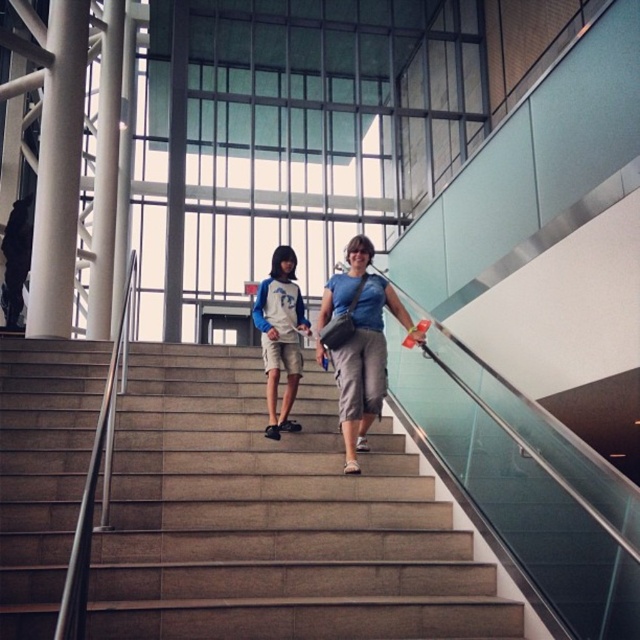
Can you confirm if blue denim shorts at center is positioned above blue and white jersey at center?

No, blue denim shorts at center is not above blue and white jersey at center.

Does blue denim shorts at center have a greater height compared to blue and white jersey at center?

Indeed, blue denim shorts at center has a greater height compared to blue and white jersey at center.

Identify the location of blue denim shorts at center. (358, 344).

Which is in front, point (77, 131) or point (300, 301)?

Point (300, 301)

What do you see at coordinates (58, 172) in the screenshot? I see `white glossy pillar at left` at bounding box center [58, 172].

Locate an element on the screen. This screenshot has width=640, height=640. white glossy pillar at left is located at coordinates (58, 172).

Between concrete stairs at center and blue denim shorts at center, which one is positioned higher?

blue denim shorts at center is higher up.

Is point (397, 582) less distant than point (337, 288)?

Yes, it is in front of point (337, 288).

Is point (193, 593) positioned after point (346, 259)?

No, it is not.

This screenshot has height=640, width=640. Identify the location of concrete stairs at center. (272, 522).